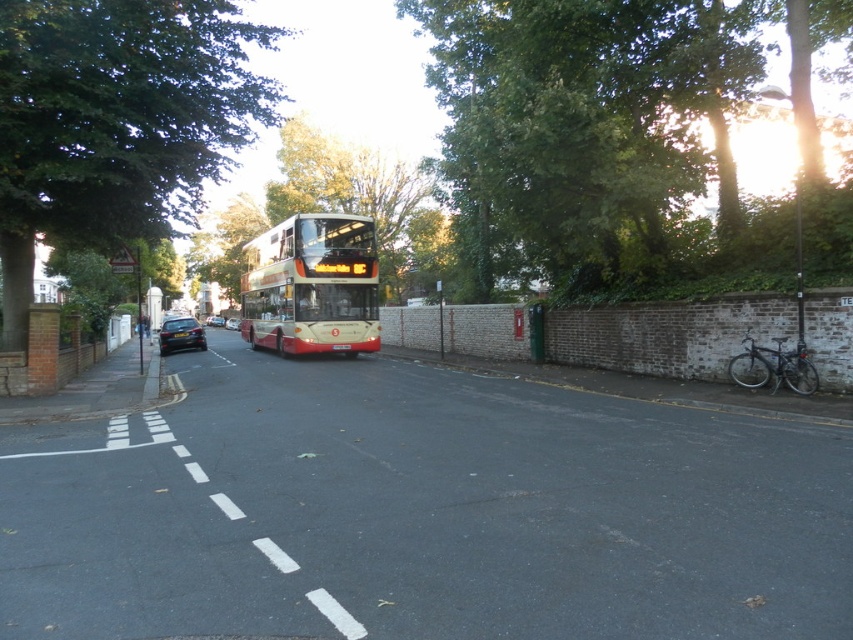
Find the location of a particular element. shiny silver car at center is located at coordinates (231, 323).

Describe the element at coordinates (231, 323) in the screenshot. I see `shiny silver car at center` at that location.

Is point (236, 328) in front of point (177, 336)?

No.

Image resolution: width=853 pixels, height=640 pixels. What are the coordinates of `shiny silver car at center` in the screenshot? It's located at (231, 323).

Between point (264, 106) and point (259, 333), which one is positioned in front?

Point (264, 106)

How far apart are green leafy tree at upper left and red polished double-decker bus at center?

A distance of 34.75 feet exists between green leafy tree at upper left and red polished double-decker bus at center.

The height and width of the screenshot is (640, 853). Describe the element at coordinates (115, 120) in the screenshot. I see `green leafy tree at upper left` at that location.

Identify the location of green leafy tree at upper left. The width and height of the screenshot is (853, 640). (115, 120).

Between point (225, 326) and point (216, 317), which one is positioned behind?

Point (216, 317)

Can you confirm if shiny silver car at center is taller than shiny black sedan at center?

Incorrect, shiny silver car at center's height is not larger of shiny black sedan at center's.

The image size is (853, 640). What do you see at coordinates (231, 323) in the screenshot?
I see `shiny silver car at center` at bounding box center [231, 323].

Where is `shiny silver car at center`? shiny silver car at center is located at coordinates (231, 323).